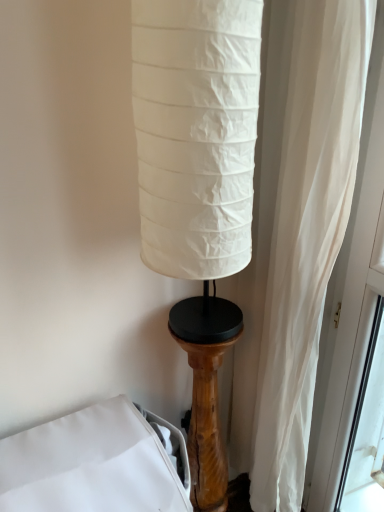
This screenshot has width=384, height=512. Find the location of `free space above wooden pedestal at lower right (from a real-world perspective)`. free space above wooden pedestal at lower right (from a real-world perspective) is located at coordinates (205, 320).